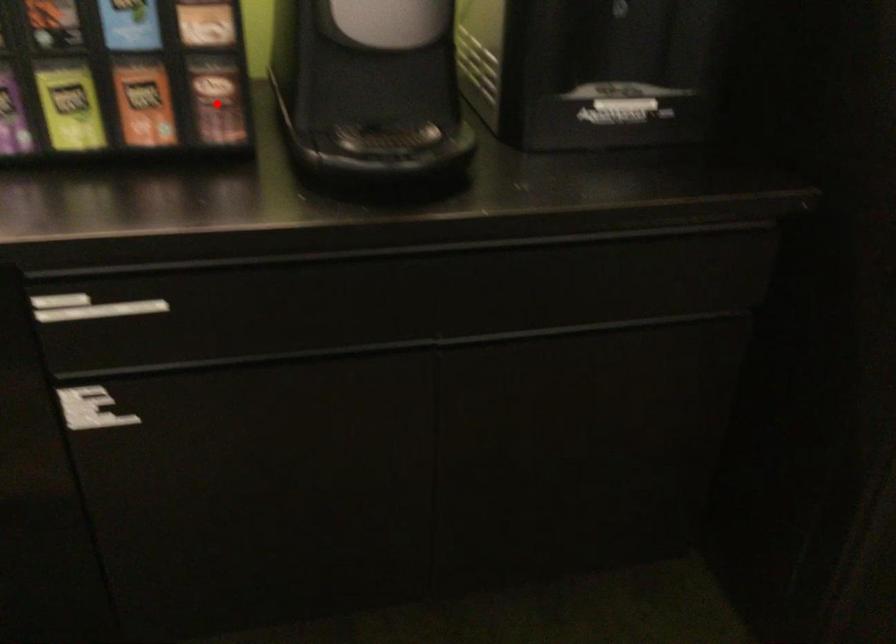
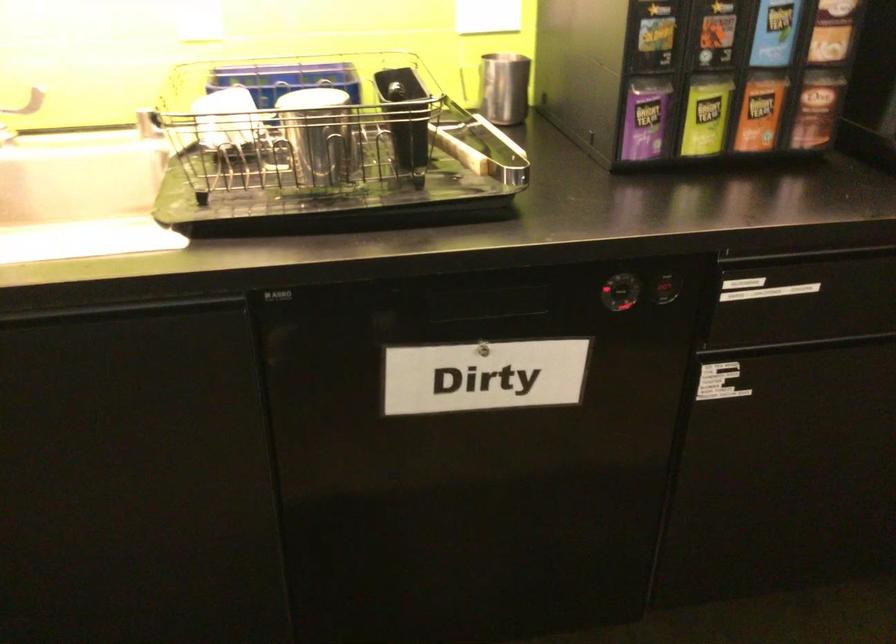
Question: I am providing you with two images of the same scene from different viewpoints. Image1 has a red point marked. In image2, the corresponding 3D location appears at what relative position? Reply with the corresponding letter.

Choices:
 (A) Closer
 (B) Farther

Answer: (B)